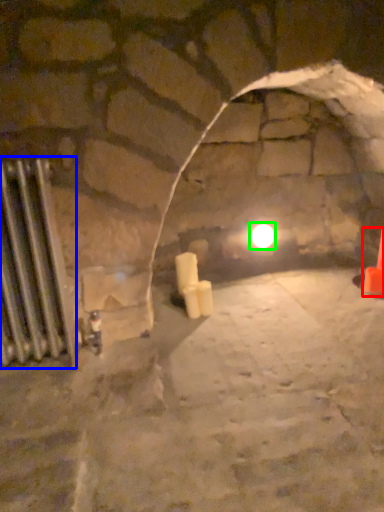
Question: Estimate the real-world distances between objects in this image. Which object is closer to traffic cone (highlighted by a red box), radiator (highlighted by a blue box) or light (highlighted by a green box)?

Choices:
 (A) radiator
 (B) light

Answer: (B)